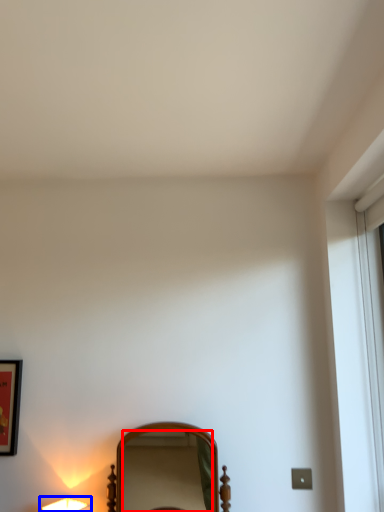
Question: Which object appears closest to the camera in this image, mirror (highlighted by a red box) or lamp (highlighted by a blue box)?

Choices:
 (A) mirror
 (B) lamp

Answer: (A)